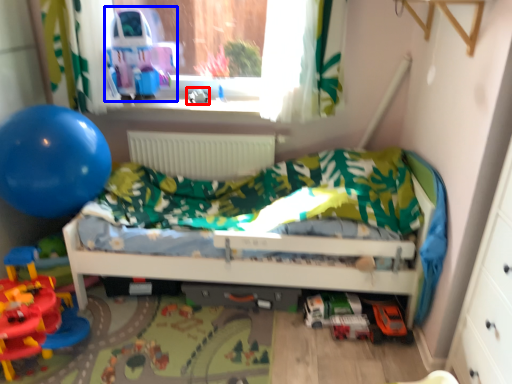
Question: Which object appears closest to the camera in this image, toy (highlighted by a red box) or toy car (highlighted by a blue box)?

Choices:
 (A) toy
 (B) toy car

Answer: (B)